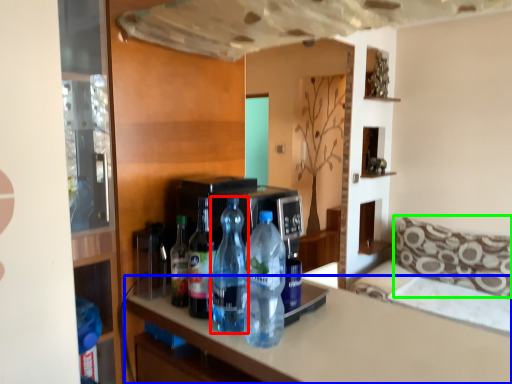
Question: Based on their relative distances, which object is farther from bottle (highlighted by a red box)? Choose from countertop (highlighted by a blue box) and pillow (highlighted by a green box).

Choices:
 (A) countertop
 (B) pillow

Answer: (B)